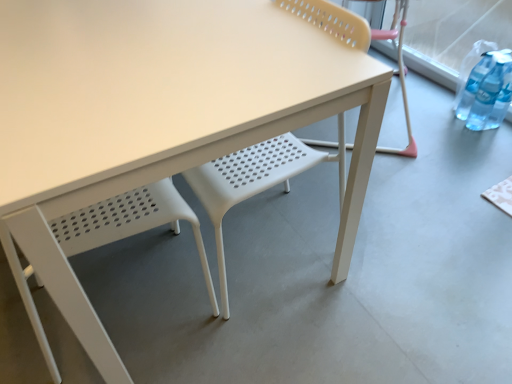
Identify the location of free point below white plastic chair at lower left, which appears as the first chair when viewed from the front (from a real-world perspective). The height and width of the screenshot is (384, 512). (134, 299).